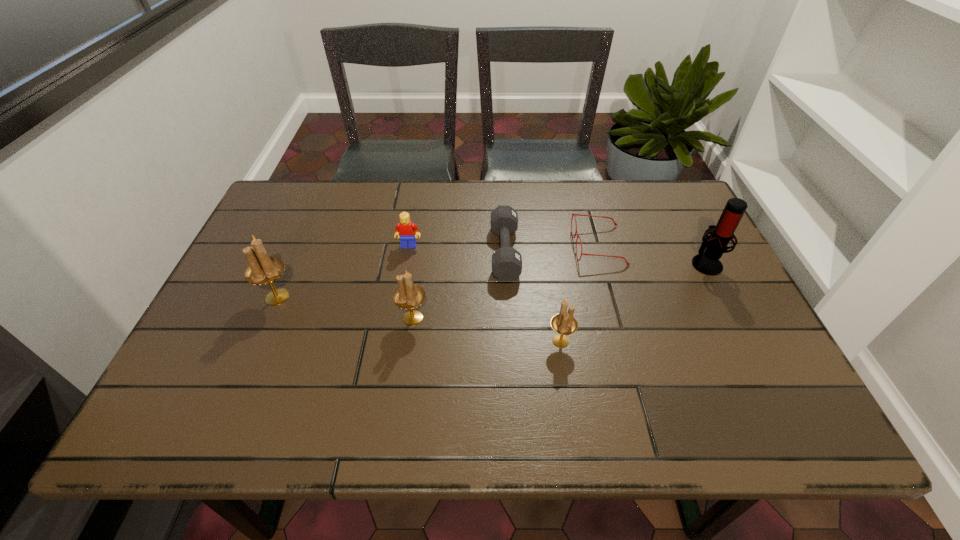
Locate an element on the screen. vacant space positioned on the face of the Lego is located at coordinates (402, 283).

What are the coordinates of `spectacles at the far edge` in the screenshot? It's located at (627, 263).

This screenshot has height=540, width=960. I want to click on dumbbell situated at the far edge, so click(506, 261).

This screenshot has width=960, height=540. I want to click on object situated at the left edge, so click(262, 269).

Find the location of a particular element. The height and width of the screenshot is (540, 960). object positioned at the right edge is located at coordinates (713, 246).

Locate an element on the screen. This screenshot has width=960, height=540. vacant region at the far edge is located at coordinates (573, 227).

The height and width of the screenshot is (540, 960). What are the coordinates of `vacant space at the near edge` in the screenshot? It's located at (462, 380).

Locate an element on the screen. The image size is (960, 540). free space at the right edge of the desktop is located at coordinates (733, 355).

Find the location of a particular element. The width and height of the screenshot is (960, 540). vacant space at the far left corner of the desktop is located at coordinates (298, 206).

Image resolution: width=960 pixels, height=540 pixels. In the image, there is a desktop. In order to click on blank space at the near left corner in this screenshot , I will do `click(200, 382)`.